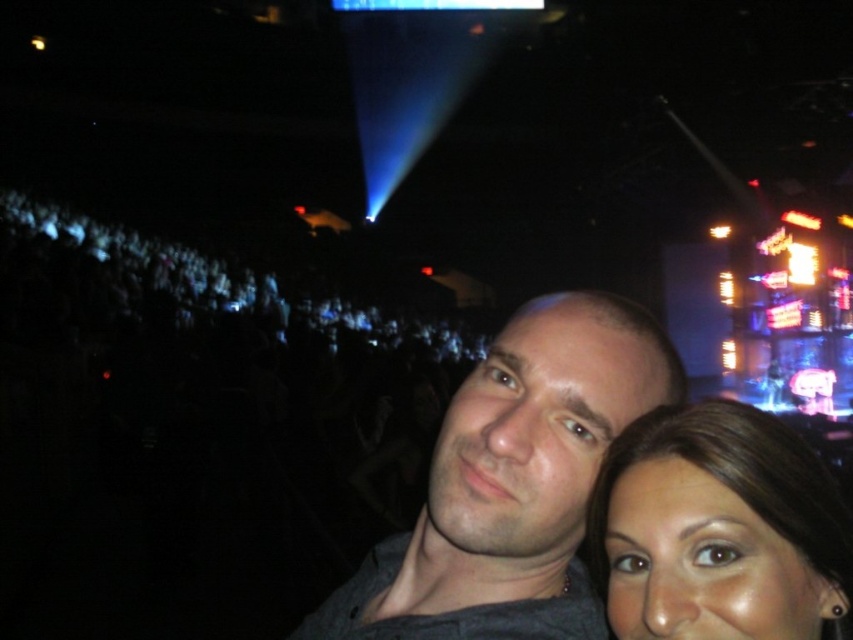
You are at a concert and want to take a photo of the dark gray shirt at center. Where should you aim your camera?

You should aim your camera at point (514,483) to capture the dark gray shirt at center.

You are at a concert and want to take a photo of the dark gray shirt at center and the brown hair at lower right. Which object should you focus on first if you want to capture both in the same frame?

The dark gray shirt at center is below brown hair at lower right, so you should focus on the brown hair at lower right first to ensure both are in the frame.

You are at a concert and want to take a photo of both the dark gray shirt at center and the brown hair at lower right. Which one should you position closer to the left side of your camera frame to include both in the photo?

You should position the dark gray shirt at center closer to the left side of your camera frame because it is already to the left of the brown hair at lower right, ensuring both are included in the photo.